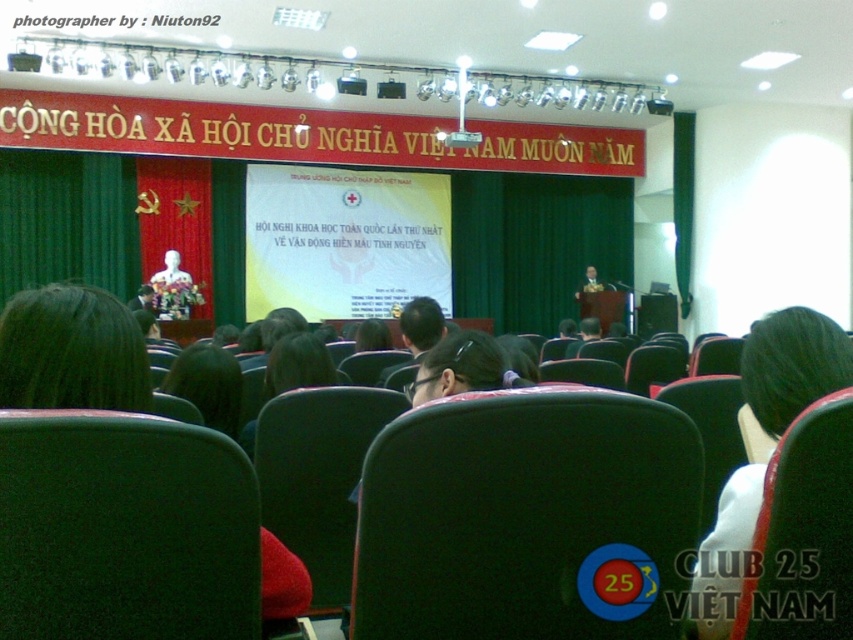
Does point (366, 596) come in front of point (740, 608)?

Yes, it is in front of point (740, 608).

Who is positioned more to the right, black fabric chair at center or white plastic chair at lower right?

white plastic chair at lower right

Locate an element on the screen. This screenshot has height=640, width=853. black fabric chair at center is located at coordinates (527, 518).

Does white plastic chair at lower right have a smaller size compared to matte white statue at center?

Correct, white plastic chair at lower right occupies less space than matte white statue at center.

Does white plastic chair at lower right appear over matte white statue at center?

No.

Is point (850, 428) farther from viewer compared to point (169, 278)?

No, (850, 428) is in front of (169, 278).

Locate an element on the screen. white plastic chair at lower right is located at coordinates (804, 532).

Between point (554, 394) and point (164, 260), which one is positioned in front?

Point (554, 394) is more forward.

Can you confirm if black fabric chair at center is smaller than matte white statue at center?

Indeed, black fabric chair at center has a smaller size compared to matte white statue at center.

Is point (426, 452) more distant than point (152, 280)?

No, it is in front of (152, 280).

Find the location of a particular element. The height and width of the screenshot is (640, 853). black fabric chair at center is located at coordinates (527, 518).